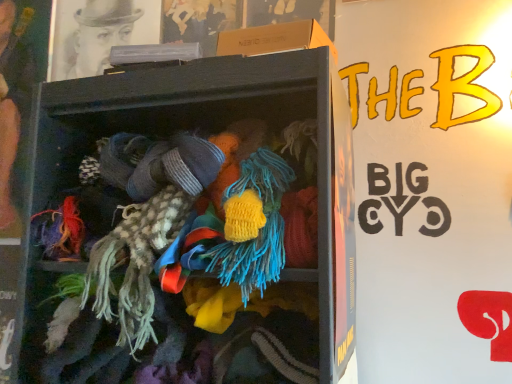
Describe the element at coordinates (189, 225) in the screenshot. I see `wooden shelf at center` at that location.

Where is `wooden shelf at center`? wooden shelf at center is located at coordinates (189, 225).

The width and height of the screenshot is (512, 384). I want to click on smooth skin face at left, so click(x=11, y=102).

Image resolution: width=512 pixels, height=384 pixels. Describe the element at coordinates (11, 102) in the screenshot. I see `smooth skin face at left` at that location.

This screenshot has height=384, width=512. In order to click on wooden shelf at center in this screenshot , I will do `click(189, 225)`.

Based on their positions, is smooth skin face at left located to the left or right of wooden shelf at center?

Clearly, smooth skin face at left is on the left of wooden shelf at center in the image.

Is the depth of smooth skin face at left less than that of wooden shelf at center?

No, smooth skin face at left is further to the viewer.

Is point (1, 171) less distant than point (285, 313)?

No, (1, 171) is further to viewer.

From the image's perspective, between smooth skin face at left and wooden shelf at center, who is located below?

wooden shelf at center is shown below in the image.

From a real-world perspective, is smooth skin face at left positioned above or below wooden shelf at center?

From a real-world perspective, smooth skin face at left is physically above wooden shelf at center.

Consider the image. Which of these two, smooth skin face at left or wooden shelf at center, is wider?

wooden shelf at center.

Between smooth skin face at left and wooden shelf at center, which one has less height?

Standing shorter between the two is wooden shelf at center.

Does smooth skin face at left have a smaller size compared to wooden shelf at center?

Yes, smooth skin face at left is smaller than wooden shelf at center.

Do you think smooth skin face at left is within wooden shelf at center, or outside of it?

The correct answer is: outside.

Is smooth skin face at left not near wooden shelf at center?

No, there isn't a large distance between smooth skin face at left and wooden shelf at center.

Is smooth skin face at left looking in the opposite direction of wooden shelf at center?

No.

How different are the orientations of smooth skin face at left and wooden shelf at center in degrees?

The facing directions of smooth skin face at left and wooden shelf at center are 0.00112 degrees apart.

Identify the location of shelf below the smooth skin face at left (from a real-world perspective). (189, 225).

Can you confirm if wooden shelf at center is positioned to the right of smooth skin face at left?

Yes.

Is wooden shelf at center in front of smooth skin face at left?

That is True.

Is point (205, 351) behind point (19, 103)?

No, (205, 351) is closer to viewer.

From the image's perspective, which is below, wooden shelf at center or smooth skin face at left?

wooden shelf at center.

From a real-world perspective, between wooden shelf at center and smooth skin face at left, who is vertically higher?

smooth skin face at left, from a real-world perspective.

Considering the relative sizes of wooden shelf at center and smooth skin face at left in the image provided, is wooden shelf at center wider than smooth skin face at left?

Correct, the width of wooden shelf at center exceeds that of smooth skin face at left.

Looking at this image, can you confirm if wooden shelf at center is taller than smooth skin face at left?

No, wooden shelf at center is not taller than smooth skin face at left.

Between wooden shelf at center and smooth skin face at left, which one has smaller size?

smooth skin face at left is smaller.

Is wooden shelf at center not within smooth skin face at left?

wooden shelf at center is positioned outside smooth skin face at left.

Are wooden shelf at center and smooth skin face at left far apart?

wooden shelf at center is actually quite close to smooth skin face at left.

Based on the photo, is wooden shelf at center positioned with its back to smooth skin face at left?

wooden shelf at center is not turned away from smooth skin face at left.

How different are the orientations of wooden shelf at center and smooth skin face at left in degrees?

There is a 0.00112-degree angle between the facing directions of wooden shelf at center and smooth skin face at left.

What are the coordinates of `person above the wooden shelf at center (from the image's perspective)` in the screenshot? It's located at (11, 102).

Image resolution: width=512 pixels, height=384 pixels. What are the coordinates of `person on the left of wooden shelf at center` in the screenshot? It's located at (11, 102).

At what (x,y) coordinates should I click in order to perform the action: click on person positioned vertically above the wooden shelf at center (from a real-world perspective). Please return your answer as a coordinate pair (x, y). The image size is (512, 384). Looking at the image, I should click on (11, 102).